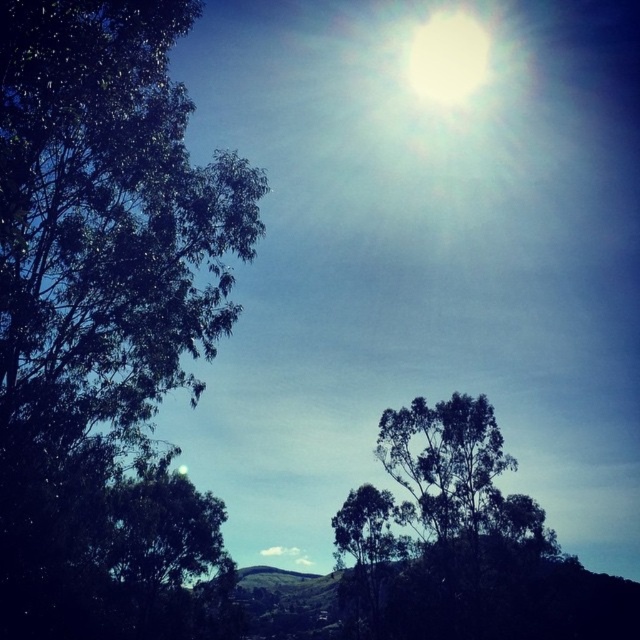
Question: Can you confirm if green leafy tree at center is positioned above white glossy sun at upper center?

Choices:
 (A) no
 (B) yes

Answer: (A)

Question: Which of the following is the closest to the observer?

Choices:
 (A) green leafy tree at left
 (B) green leafy tree at center

Answer: (A)

Question: Which point is farther from the camera taking this photo?

Choices:
 (A) (449, 528)
 (B) (432, 42)
 (C) (33, 484)

Answer: (B)

Question: Can you confirm if green leafy tree at left is thinner than green leafy tree at center?

Choices:
 (A) yes
 (B) no

Answer: (A)

Question: Which of the following is the farthest from the observer?

Choices:
 (A) (484, 524)
 (B) (442, 100)
 (C) (205, 563)

Answer: (B)

Question: Does green leafy tree at left have a smaller size compared to white glossy sun at upper center?

Choices:
 (A) yes
 (B) no

Answer: (B)